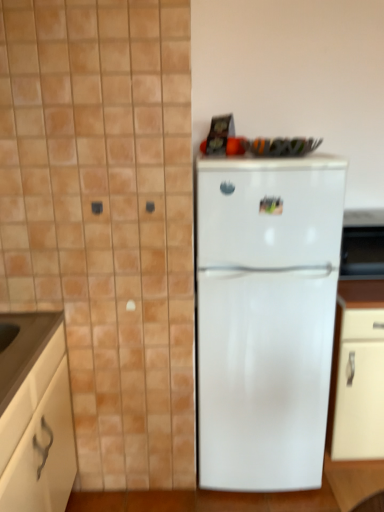
This screenshot has width=384, height=512. What do you see at coordinates (265, 318) in the screenshot?
I see `white glossy refrigerator at center` at bounding box center [265, 318].

Identify the location of white glossy refrigerator at center. (265, 318).

Describe the element at coordinates (35, 414) in the screenshot. I see `white matte cabinet at lower left` at that location.

The height and width of the screenshot is (512, 384). What are the coordinates of `white matte cabinet at lower left` in the screenshot? It's located at (35, 414).

The image size is (384, 512). What are the coordinates of `white glossy refrigerator at center` in the screenshot? It's located at tap(265, 318).

Would you say white glossy refrigerator at center is to the left or to the right of white matte cabinet at lower left in the picture?

Based on their positions, white glossy refrigerator at center is located to the right of white matte cabinet at lower left.

Is white glossy refrigerator at center closer to the viewer compared to white matte cabinet at lower left?

No, the depth of white glossy refrigerator at center is greater than that of white matte cabinet at lower left.

Which is behind, point (329, 386) or point (35, 428)?

The point (329, 386) is behind.

From the image's perspective, is white glossy refrigerator at center above or below white matte cabinet at lower left?

Based on their image positions, white glossy refrigerator at center is located above white matte cabinet at lower left.

From a real-world perspective, which is physically above, white glossy refrigerator at center or white matte cabinet at lower left?

In real-world perspective, white glossy refrigerator at center is above.

Can you confirm if white glossy refrigerator at center is wider than white matte cabinet at lower left?

Correct, the width of white glossy refrigerator at center exceeds that of white matte cabinet at lower left.

Considering the sizes of white glossy refrigerator at center and white matte cabinet at lower left in the image, is white glossy refrigerator at center taller or shorter than white matte cabinet at lower left?

In the image, white glossy refrigerator at center appears to be taller than white matte cabinet at lower left.

Is white glossy refrigerator at center smaller than white matte cabinet at lower left?

No.

Can we say white glossy refrigerator at center lies outside white matte cabinet at lower left?

white glossy refrigerator at center lies outside white matte cabinet at lower left's area.

Does white glossy refrigerator at center touch white matte cabinet at lower left?

No, white glossy refrigerator at center is not making contact with white matte cabinet at lower left.

Is white matte cabinet at lower left at the back of white glossy refrigerator at center?

white glossy refrigerator at center is not turned away from white matte cabinet at lower left.

What's the angular difference between white glossy refrigerator at center and white matte cabinet at lower left's facing directions?

The angle between the facing direction of white glossy refrigerator at center and the facing direction of white matte cabinet at lower left is 92.5 degrees.

Identify the location of cabinetry on the left of white glossy refrigerator at center. (35, 414).

In the image, is white matte cabinet at lower left on the left side or the right side of white glossy refrigerator at center?

In the image, white matte cabinet at lower left appears on the left side of white glossy refrigerator at center.

Considering the relative positions of white matte cabinet at lower left and white glossy refrigerator at center in the image provided, is white matte cabinet at lower left behind white glossy refrigerator at center?

No, it is in front of white glossy refrigerator at center.

Which is farther, (16,483) or (237,283)?

The point (237,283) is farther.

From the image's perspective, between white matte cabinet at lower left and white glossy refrigerator at center, who is located below?

white matte cabinet at lower left.

From a real-world perspective, does white matte cabinet at lower left sit lower than white glossy refrigerator at center?

Yes, from a real-world perspective, white matte cabinet at lower left is beneath white glossy refrigerator at center.

Looking at their sizes, would you say white matte cabinet at lower left is wider or thinner than white glossy refrigerator at center?

In the image, white matte cabinet at lower left appears to be more narrow than white glossy refrigerator at center.

Considering the relative sizes of white matte cabinet at lower left and white glossy refrigerator at center in the image provided, is white matte cabinet at lower left shorter than white glossy refrigerator at center?

Indeed, white matte cabinet at lower left has a lesser height compared to white glossy refrigerator at center.

Which of these two, white matte cabinet at lower left or white glossy refrigerator at center, is smaller?

With smaller size is white matte cabinet at lower left.

Is white glossy refrigerator at center inside white matte cabinet at lower left?

Definitely not — white glossy refrigerator at center is not inside white matte cabinet at lower left.

Is the surface of white matte cabinet at lower left in direct contact with white glossy refrigerator at center?

No, white matte cabinet at lower left is not making contact with white glossy refrigerator at center.

Is white matte cabinet at lower left facing away from white glossy refrigerator at center?

No, white glossy refrigerator at center is not at the back of white matte cabinet at lower left.

Identify the location of refrigerator lying behind the white matte cabinet at lower left. The width and height of the screenshot is (384, 512). (265, 318).

There is a white matte cabinet at lower left. Identify the location of refrigerator above it (from a real-world perspective). The height and width of the screenshot is (512, 384). (265, 318).

At what (x,y) coordinates should I click in order to perform the action: click on cabinetry below the white glossy refrigerator at center (from the image's perspective). Please return your answer as a coordinate pair (x, y). This screenshot has width=384, height=512. Looking at the image, I should click on (35, 414).